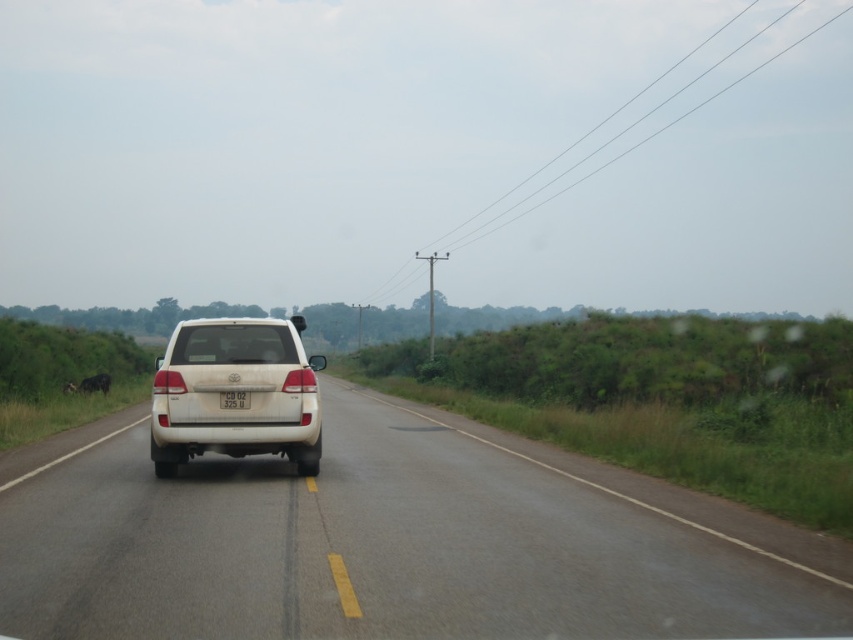
Is dark brown fur at left to the left of white plastic license plate at center from the viewer's perspective?

Yes, dark brown fur at left is to the left of white plastic license plate at center.

The width and height of the screenshot is (853, 640). Identify the location of dark brown fur at left. (90, 385).

Between white matte suv at center and dark brown fur at left, which one appears on the left side from the viewer's perspective?

From the viewer's perspective, dark brown fur at left appears more on the left side.

Can you confirm if white matte suv at center is wider than dark brown fur at left?

Yes, white matte suv at center is wider than dark brown fur at left.

Which is in front, point (163, 384) or point (106, 381)?

Point (163, 384) is in front.

This screenshot has width=853, height=640. In order to click on white matte suv at center in this screenshot , I will do `click(235, 388)`.

Which is below, white glossy suv at center or dark brown fur at left?

dark brown fur at left

Is point (720, 609) in front of point (99, 390)?

Yes, it is.

At what (x,y) coordinates should I click in order to perform the action: click on white glossy suv at center. Please return your answer as a coordinate pair (x, y). This screenshot has height=640, width=853. Looking at the image, I should click on (399, 545).

Locate an element on the screen. This screenshot has height=640, width=853. white glossy suv at center is located at coordinates (399, 545).